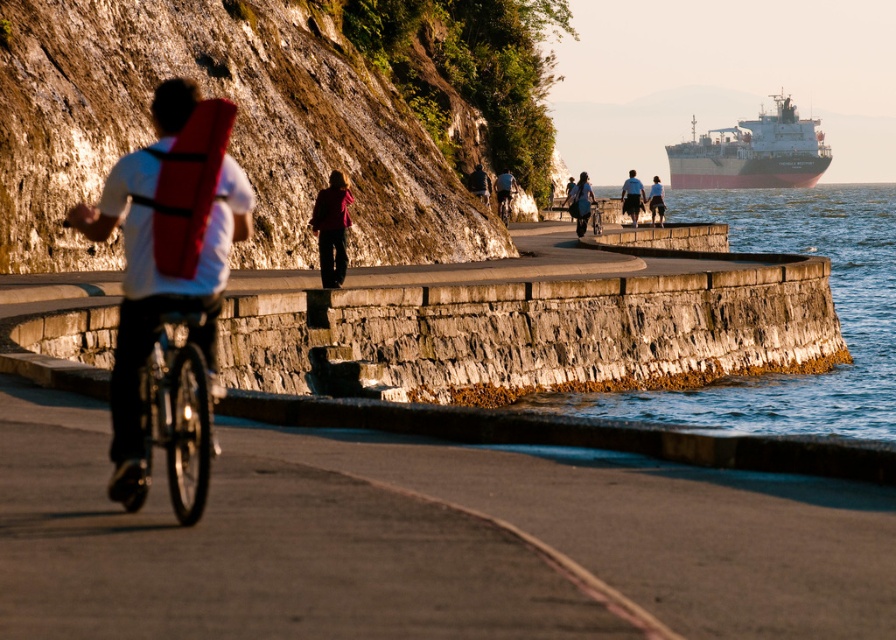
Question: Which object is positioned farthest from the shiny metallic bicycle at center?

Choices:
 (A) matte black shorts at center
 (B) matte red jacket at center
 (C) matte black jacket at center

Answer: (B)

Question: Is matte black jacket at center thinner than shiny metallic bicycle at center?

Choices:
 (A) no
 (B) yes

Answer: (B)

Question: Estimate the real-world distances between objects in this image. Which object is farther from the light blue shirt at center?

Choices:
 (A) shiny metallic bicycle at center
 (B) shiny black bicycle at left
 (C) white matte cargo ship at upper right

Answer: (C)

Question: Can you confirm if matte red backpack at left is positioned above metallic silver bicycle at center?

Choices:
 (A) no
 (B) yes

Answer: (A)

Question: Which of the following is the closest to the observer?

Choices:
 (A) shiny metallic bicycle at center
 (B) metallic silver bicycle at center
 (C) matte black shorts at center
 (D) white matte cargo ship at upper right

Answer: (A)

Question: Does matte red backpack at center appear on the right side of matte black jacket at center?

Choices:
 (A) yes
 (B) no

Answer: (A)